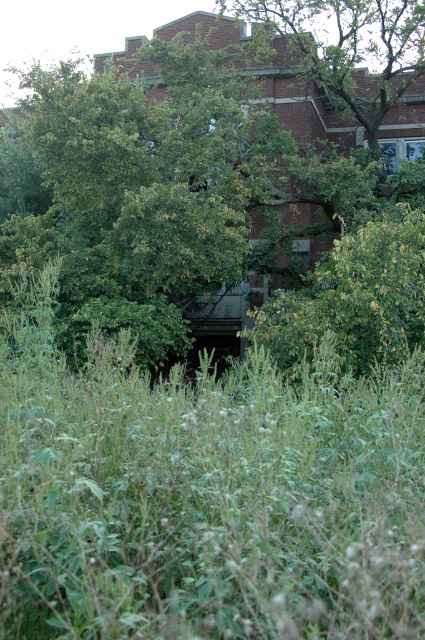
Question: Is green leafy tree at center further to camera compared to green leafy grass at center?

Choices:
 (A) no
 (B) yes

Answer: (B)

Question: Which of the following is the closest to the observer?

Choices:
 (A) (294, 1)
 (B) (170, 396)

Answer: (B)

Question: Can you confirm if green leafy grass at center is thinner than green leafy tree at upper center?

Choices:
 (A) no
 (B) yes

Answer: (A)

Question: Is green leafy grass at center positioned behind green leafy tree at upper center?

Choices:
 (A) no
 (B) yes

Answer: (A)

Question: Which of the following is the farthest from the observer?

Choices:
 (A) (396, 83)
 (B) (399, 440)
 (C) (93, 291)

Answer: (A)

Question: Which point is closer to the camera?

Choices:
 (A) (252, 17)
 (B) (322, 588)
 (C) (331, 323)

Answer: (B)